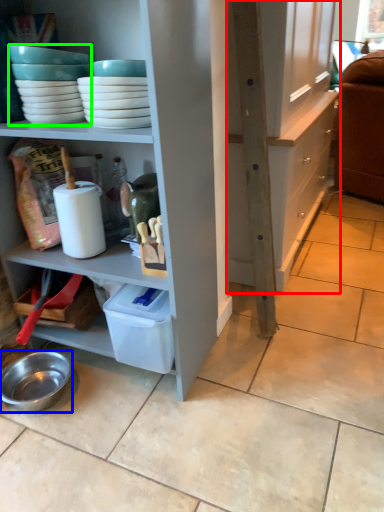
Question: Which object is positioned farthest from cabinetry (highlighted by a red box)? Select from bowl (highlighted by a blue box) and tableware (highlighted by a green box).

Choices:
 (A) bowl
 (B) tableware

Answer: (A)